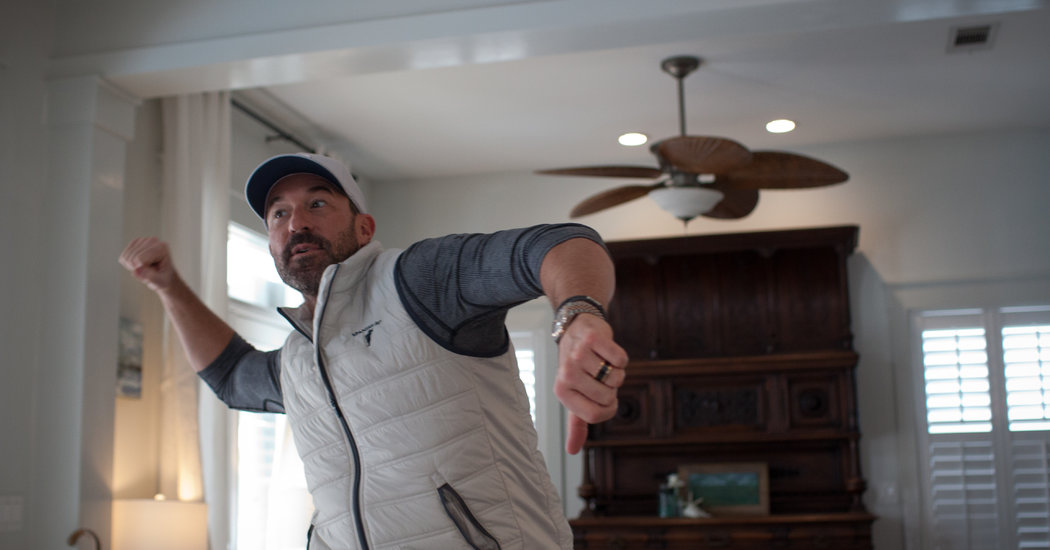
Locate an element on the screen. The image size is (1050, 550). air conditioner vent is located at coordinates (969, 33).